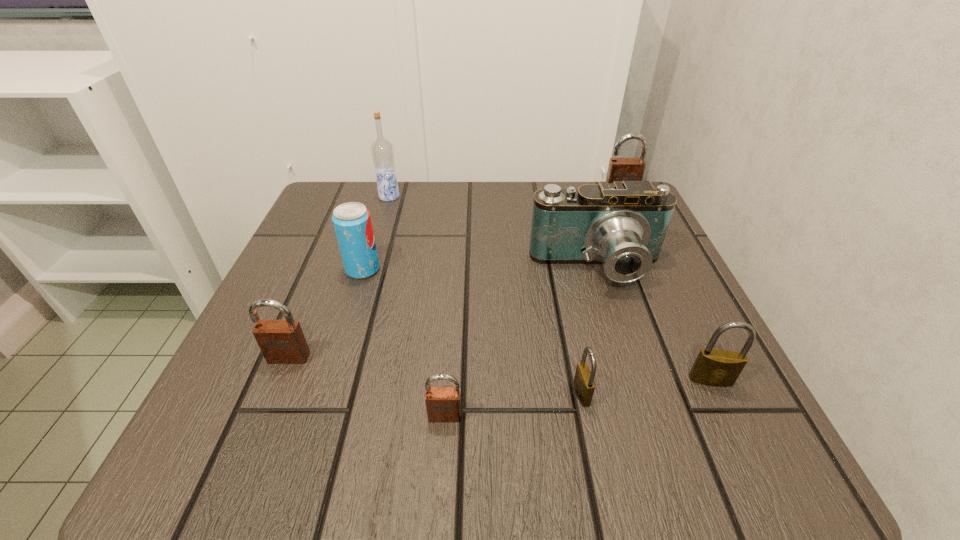
At what (x,y) coordinates should I click in order to perform the action: click on free point between the nearest padlock and the blue camcorder. Please return your answer as a coordinate pair (x, y). Image resolution: width=960 pixels, height=540 pixels. Looking at the image, I should click on (521, 342).

Locate an element on the screen. The height and width of the screenshot is (540, 960). vacant space that is in between the bigger brass padlock and the camcorder is located at coordinates (654, 325).

The image size is (960, 540). In order to click on free spot between the left brass padlock and the nearest brown padlock in this screenshot , I will do `click(514, 404)`.

Select which object is the fourth closest to the camcorder. Please provide its 2D coordinates. Your answer should be formatted as a tuple, i.e. [(x, y)], where the tuple contains the x and y coordinates of a point satisfying the conditions above.

[(443, 404)]

Where is `object that is the sixth closest one to the left brass padlock`? object that is the sixth closest one to the left brass padlock is located at coordinates (620, 169).

You are a GUI agent. You are given a task and a screenshot of the screen. Output one action in this format:
    pyautogui.click(x=<x>, y=<y>)
    Task: Click on the second closest padlock to the tallest object
    
    Given the screenshot: What is the action you would take?
    pyautogui.click(x=620, y=169)

Select which padlock appears as the third closest to the second smallest brown padlock. Please provide its 2D coordinates. Your answer should be formatted as a tuple, i.e. [(x, y)], where the tuple contains the x and y coordinates of a point satisfying the conditions above.

[(713, 367)]

Select which brown padlock appears as the closest to the farthest padlock. Please provide its 2D coordinates. Your answer should be formatted as a tuple, i.e. [(x, y)], where the tuple contains the x and y coordinates of a point satisfying the conditions above.

[(443, 404)]

Locate an element on the screen. This screenshot has width=960, height=540. the closest brown padlock relative to the farthest padlock is located at coordinates (443, 404).

The image size is (960, 540). Find the location of `free space that satisfies the following two spatial constraints: 1. on the front-facing side of the right brass padlock; 2. on the left side of the camcorder`. free space that satisfies the following two spatial constraints: 1. on the front-facing side of the right brass padlock; 2. on the left side of the camcorder is located at coordinates (632, 380).